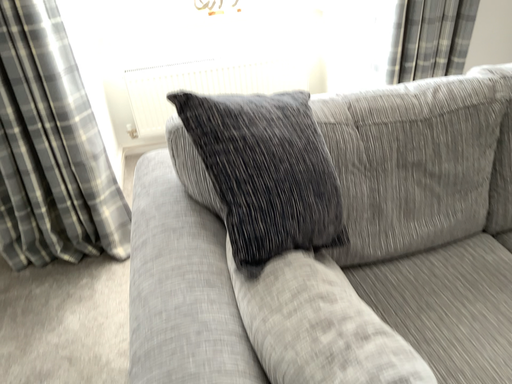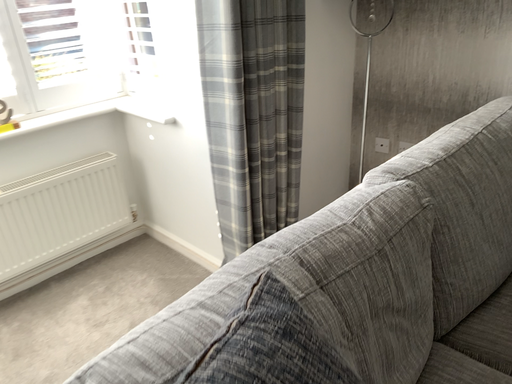
Question: Which way did the camera rotate in the video?

Choices:
 (A) rotated upward
 (B) rotated downward

Answer: (A)